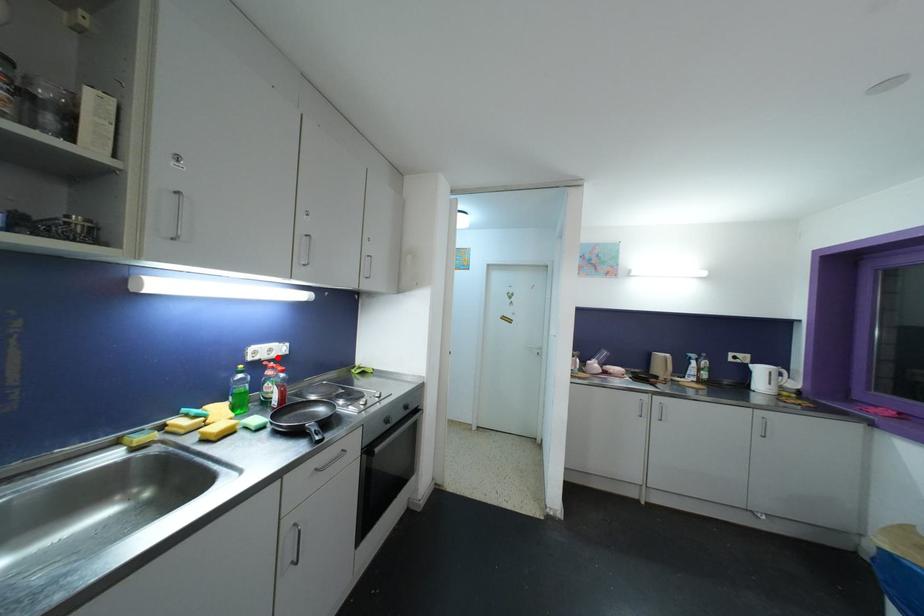
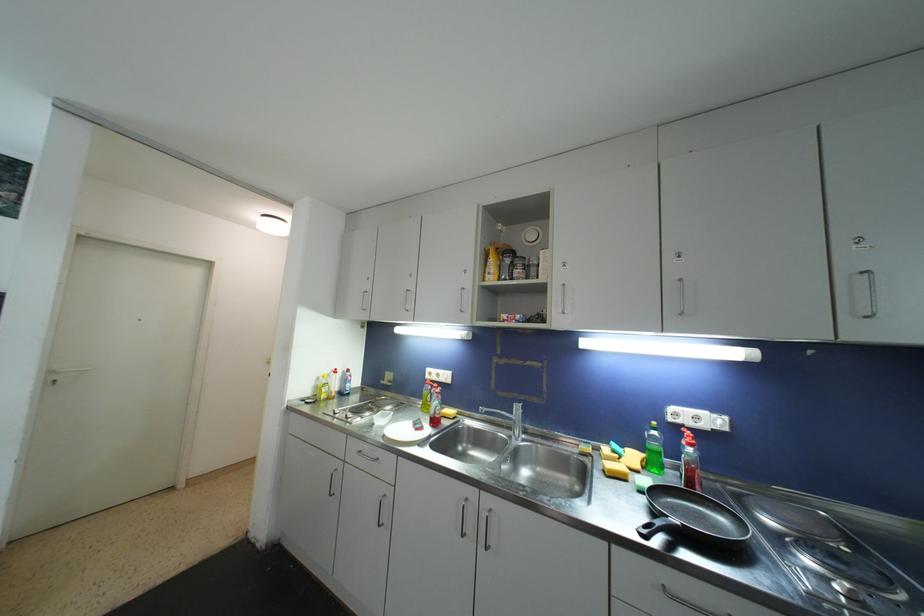
Locate, in the second image, the point that corresponds to the highlighted location in the first image.

(708, 429)